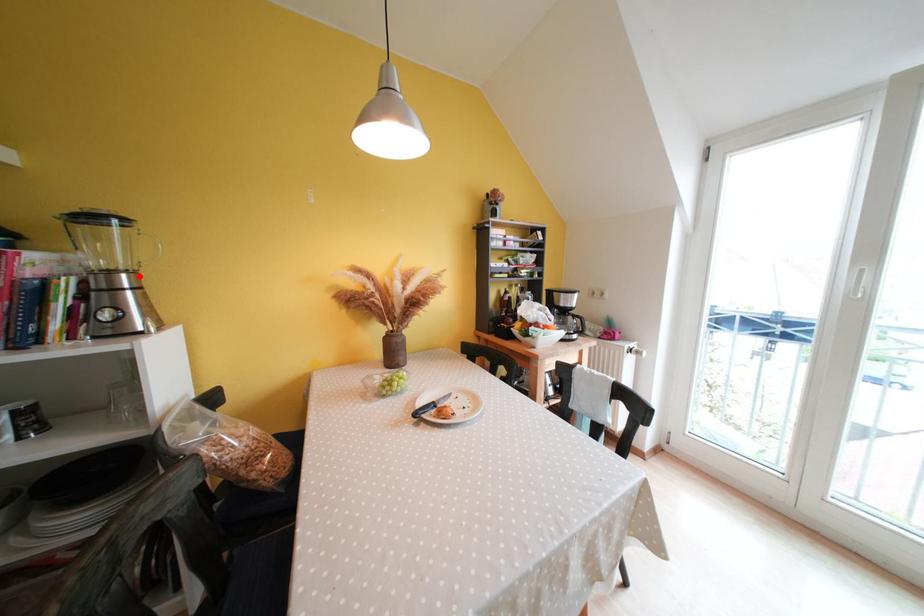
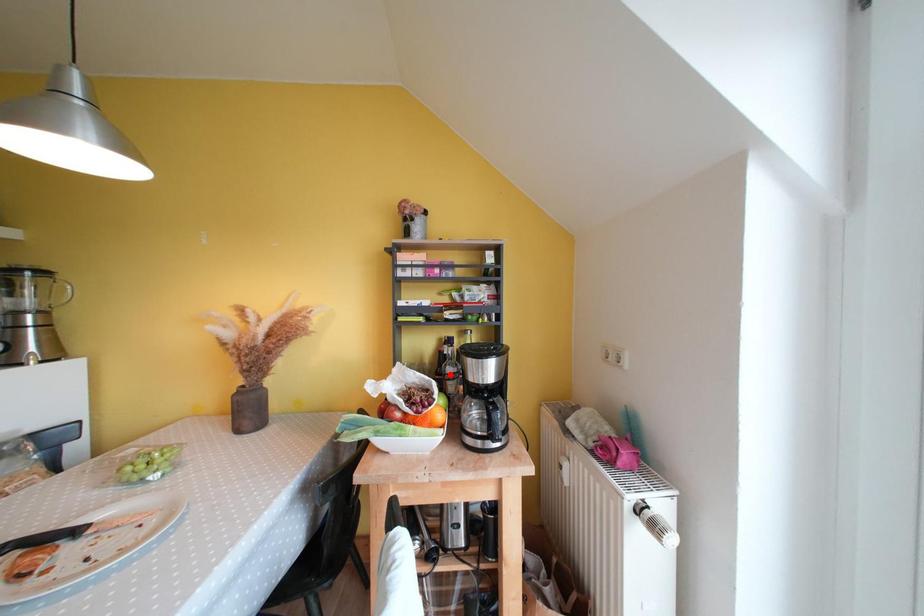
I am providing you with two images of the same scene from different viewpoints. A red point is marked on the first image and another point is marked on the second image. Are the points marked in image1 and image2 representing the same 3D position?

No